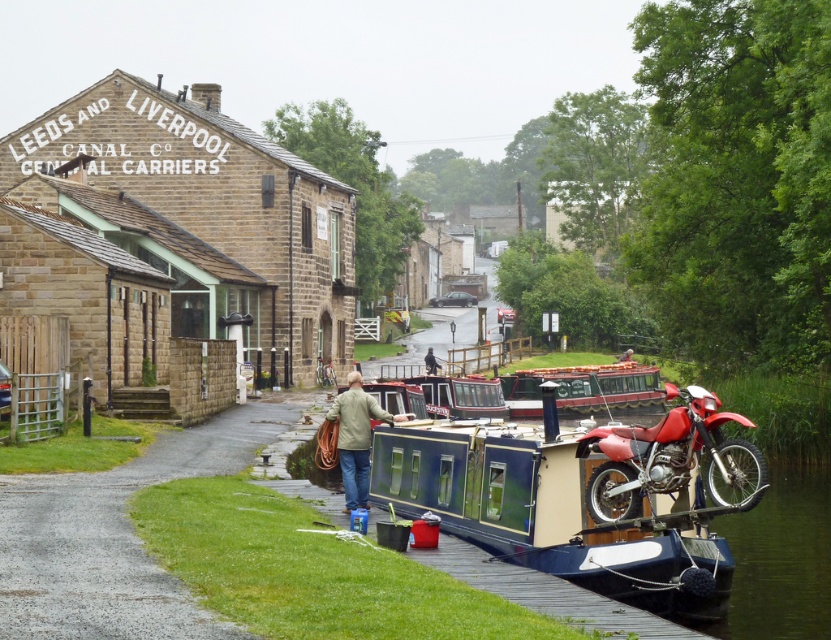
You are a delivery person who needs to load a package onto the blue polished wood barge at center and the silver metallic bicycle at center. Which object requires a larger loading area?

The silver metallic bicycle at center requires a larger loading area because the blue polished wood barge at center is smaller than the silver metallic bicycle at center.

You are a photographer standing at the edge of the canal, and you want to take a photo of the blue polished wood barge at center and the light brown leather jacket at center. Which object should you adjust your camera to focus on first if you want to capture both in the same frame?

The blue polished wood barge at center is to the right of light brown leather jacket at center, so you should focus on the light brown leather jacket at center first to ensure both are in frame.

You are a photographer standing at the edge of the canal, and you want to capture the khaki fabric jacket at center in your shot. If your camera has a maximum zoom range of 15 meters, will you be able to focus on the jacket clearly?

The khaki fabric jacket at center is 17.14 meters away from the viewer. Since the camera can only zoom up to 15 meters, it won